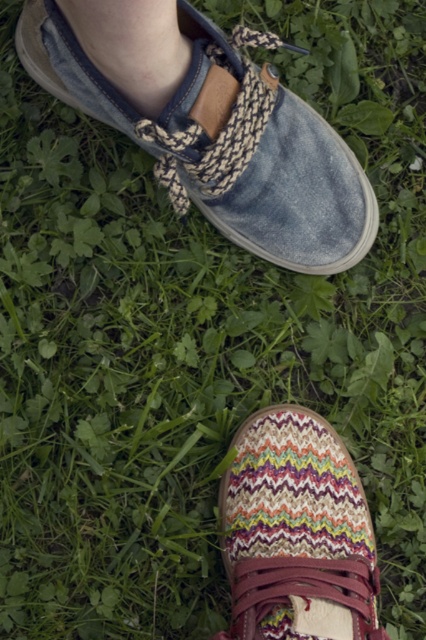
You are standing in front of two shoes in the image. The first shoe is at point [278,156] and the second shoe is at point [149,29]. Which shoe is closer to you?

Point [278,156] is further to the viewer than point [149,29]. Therefore, the shoe at point [149,29] is closer to you.

Looking at this image, you are a photographer trying to capture both the denim canvas shoe at upper center and the skinny white sock at upper left in a single shot. Based on their positions, which shoe should you adjust to the left to frame them better?

The denim canvas shoe at upper center is to the right of the skinny white sock at upper left, so you should move the denim canvas shoe at upper center to the left to frame them better.

You are trying to decide which shoe to wear for a walk in the park. You have the woven fabric shoe at lower center and the skinny white sock at upper left. Which one has a wider base?

The woven fabric shoe at lower center has a wider base than the skinny white sock at upper left.